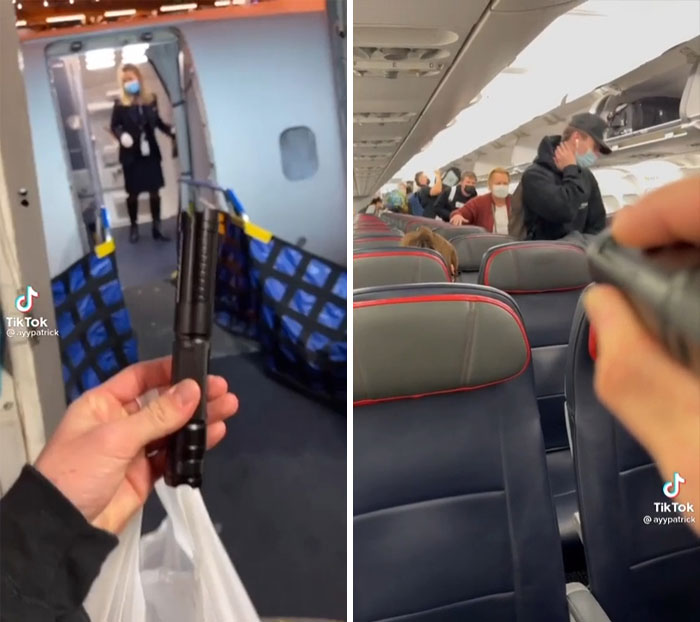
Locate an element on the screen. Image resolution: width=700 pixels, height=622 pixels. empty seats is located at coordinates (462, 465), (608, 451), (530, 262), (398, 269).